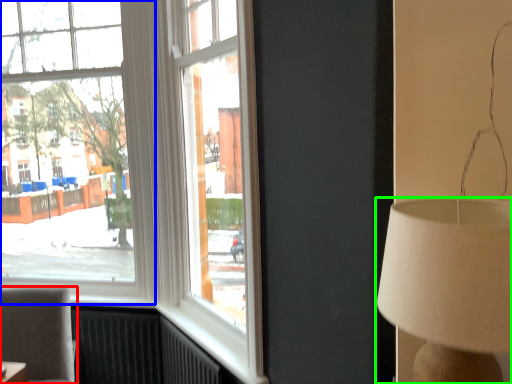
Question: Which object is the closest to the furniture (highlighted by a red box)? Choose among these: window (highlighted by a blue box) or lamp (highlighted by a green box).

Choices:
 (A) window
 (B) lamp

Answer: (A)